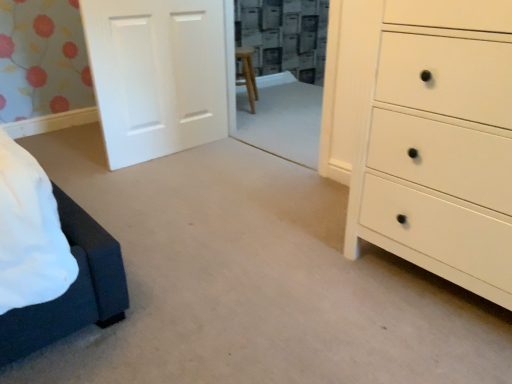
Measure the distance between white matte door at upper left and camera.

white matte door at upper left and camera are 6.66 feet apart from each other.

In order to face white matte door at upper left, should I rotate leftwards or rightwards?

Turn left approximately 11.680 degrees to face it.

Identify the location of white matte door at upper left. (156, 75).

Describe the element at coordinates (156, 75) in the screenshot. Image resolution: width=512 pixels, height=384 pixels. I see `white matte door at upper left` at that location.

The height and width of the screenshot is (384, 512). Find the location of `white matte chest of drawers at right`. white matte chest of drawers at right is located at coordinates (425, 133).

Image resolution: width=512 pixels, height=384 pixels. What do you see at coordinates (425, 133) in the screenshot?
I see `white matte chest of drawers at right` at bounding box center [425, 133].

I want to click on white matte door at upper left, so click(156, 75).

Considering the positions of objects white matte door at upper left and white matte chest of drawers at right in the image provided, who is more to the left, white matte door at upper left or white matte chest of drawers at right?

white matte door at upper left is more to the left.

In the image, is white matte door at upper left positioned in front of or behind white matte chest of drawers at right?

In the image, white matte door at upper left appears behind white matte chest of drawers at right.

Between point (178, 73) and point (336, 36), which one is positioned in front?

Point (336, 36)

From the image's perspective, is white matte door at upper left positioned above or below white matte chest of drawers at right?

Based on their image positions, white matte door at upper left is located above white matte chest of drawers at right.

From a real-world perspective, is white matte door at upper left located higher than white matte chest of drawers at right?

No.

Considering the sizes of objects white matte door at upper left and white matte chest of drawers at right in the image provided, who is thinner, white matte door at upper left or white matte chest of drawers at right?

With smaller width is white matte door at upper left.

Looking at this image, considering the relative sizes of white matte door at upper left and white matte chest of drawers at right in the image provided, is white matte door at upper left shorter than white matte chest of drawers at right?

Correct, white matte door at upper left is not as tall as white matte chest of drawers at right.

Does white matte door at upper left have a smaller size compared to white matte chest of drawers at right?

Yes, white matte door at upper left is smaller than white matte chest of drawers at right.

Can white matte chest of drawers at right be found inside white matte door at upper left?

No, white matte door at upper left does not contain white matte chest of drawers at right.

Looking at this image, are white matte door at upper left and white matte chest of drawers at right beside each other?

white matte door at upper left and white matte chest of drawers at right are not in contact.

Is white matte door at upper left oriented towards white matte chest of drawers at right?

Yes, white matte door at upper left is oriented towards white matte chest of drawers at right.

Identify the location of the chest of drawers lying below the white matte door at upper left (from the image's perspective). (425, 133).

Is white matte chest of drawers at right at the right side of white matte door at upper left?

Yes, white matte chest of drawers at right is to the right of white matte door at upper left.

Considering the relative positions of white matte chest of drawers at right and white matte door at upper left in the image provided, is white matte chest of drawers at right behind white matte door at upper left?

No, white matte chest of drawers at right is in front of white matte door at upper left.

Does point (426, 132) come farther from viewer compared to point (217, 68)?

No, (426, 132) is closer to viewer.

From the image's perspective, would you say white matte chest of drawers at right is shown under white matte door at upper left?

Yes, from the image's perspective, white matte chest of drawers at right is beneath white matte door at upper left.

From a real-world perspective, which object rests below the other?

white matte door at upper left, from a real-world perspective.

Does white matte chest of drawers at right have a greater width compared to white matte door at upper left?

Yes, white matte chest of drawers at right is wider than white matte door at upper left.

Considering the relative sizes of white matte chest of drawers at right and white matte door at upper left in the image provided, is white matte chest of drawers at right taller than white matte door at upper left?

Correct, white matte chest of drawers at right is much taller as white matte door at upper left.

Can you confirm if white matte chest of drawers at right is smaller than white matte door at upper left?

No.

Consider the image. Is white matte chest of drawers at right located outside white matte door at upper left?

That's correct, white matte chest of drawers at right is outside of white matte door at upper left.

Is white matte chest of drawers at right next to white matte door at upper left and touching it?

white matte chest of drawers at right is not next to white matte door at upper left, and they're not touching.

Could you tell me if white matte chest of drawers at right is facing white matte door at upper left?

No, white matte chest of drawers at right is not oriented towards white matte door at upper left.

Find the location of a particular element. The image size is (512, 384). the chest of drawers that appears above the white matte door at upper left (from a real-world perspective) is located at coordinates (425, 133).

The height and width of the screenshot is (384, 512). I want to click on door below the white matte chest of drawers at right (from a real-world perspective), so click(x=156, y=75).

This screenshot has width=512, height=384. I want to click on the chest of drawers lying below the white matte door at upper left (from the image's perspective), so 425,133.